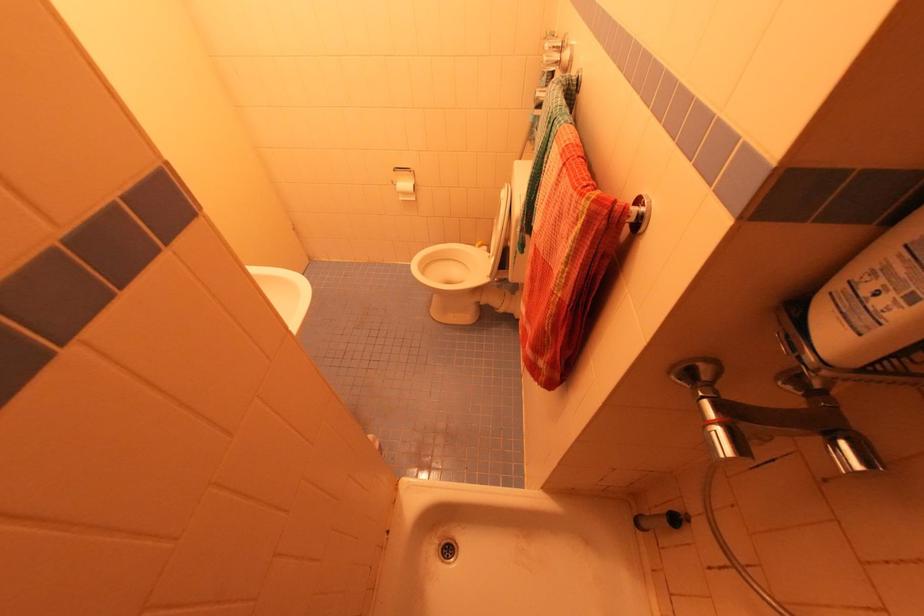
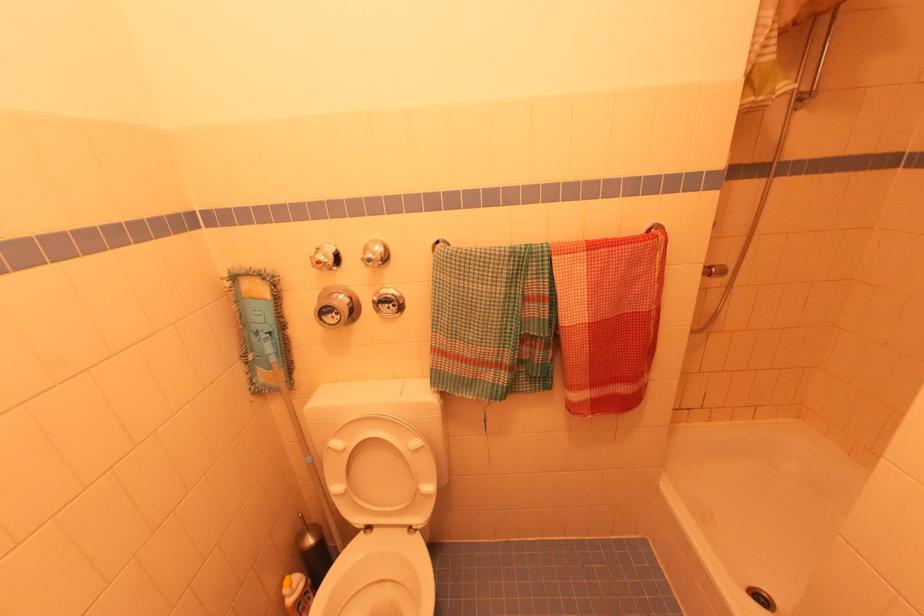
Where in the second image is the point corresponding to point 482,249 from the first image?

(296, 585)